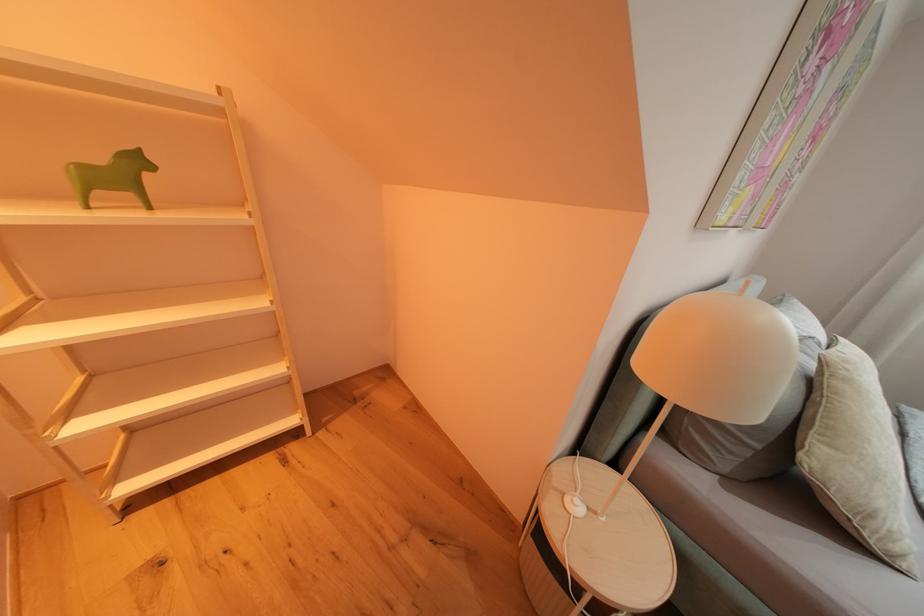
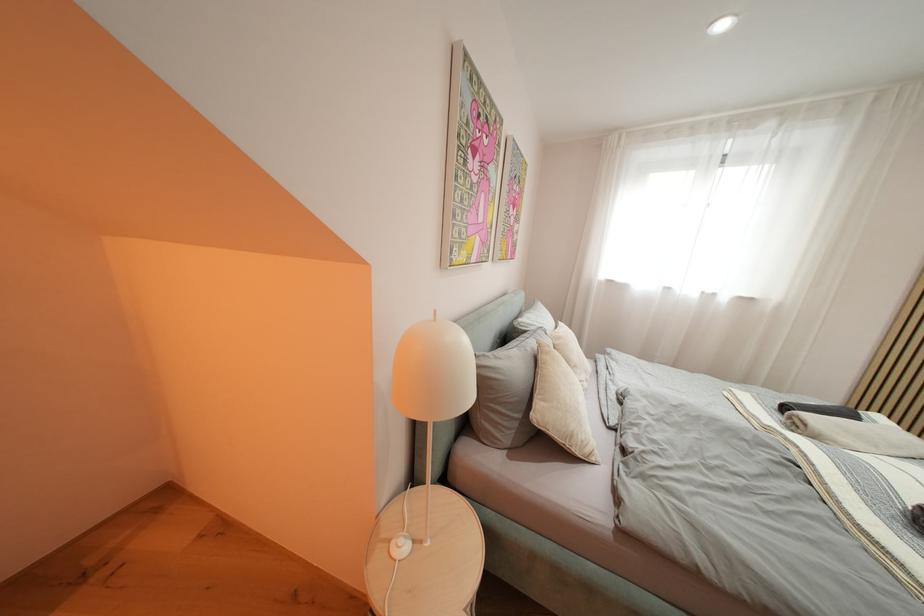
Question: How did the camera likely rotate?

Choices:
 (A) Left
 (B) Right
 (C) Up
 (D) Down

Answer: (B)